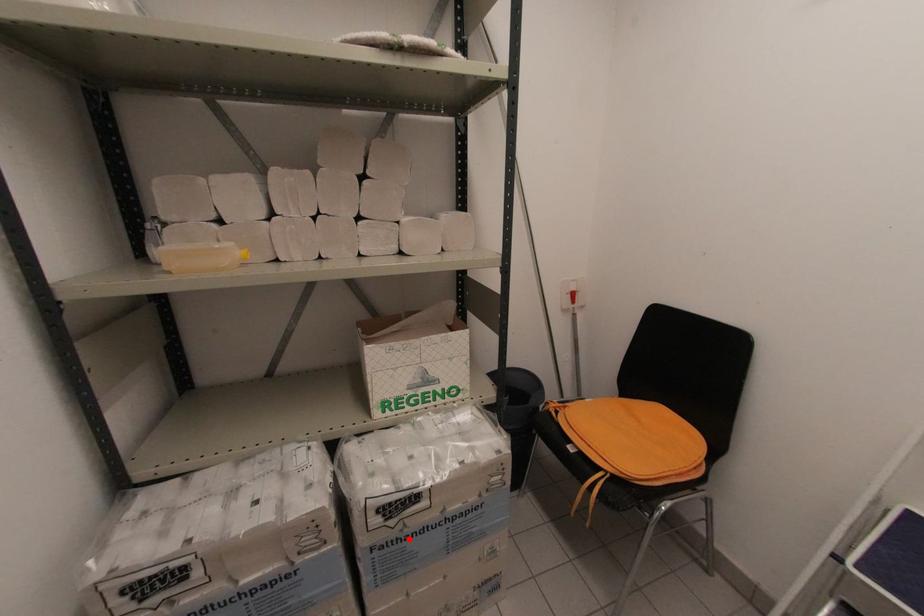
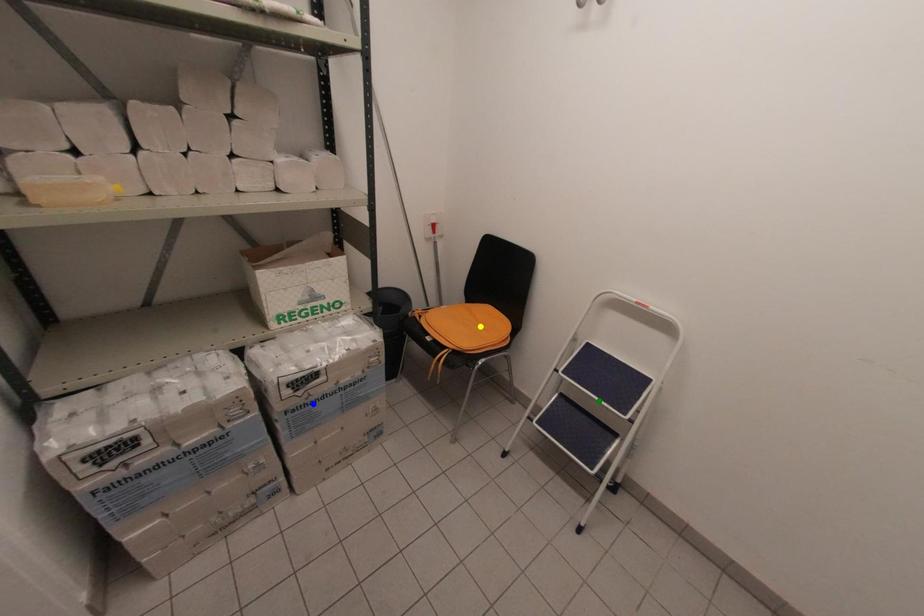
Question: I am providing you with two images of the same scene from different viewpoints. A red point is marked on the first image. You are given multiple points on the second image. In image 2, which mark is for the same physical point as the one in image 1?

Choices:
 (A) blue point
 (B) green point
 (C) yellow point

Answer: (A)